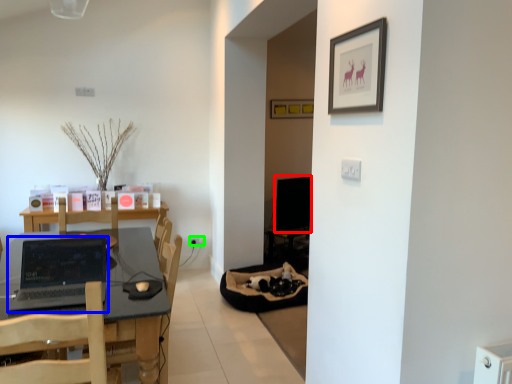
Question: Based on their relative distances, which object is nearer to computer monitor (highlighted by a red box)? Choose from laptop (highlighted by a blue box) and electric outlet (highlighted by a green box).

Choices:
 (A) laptop
 (B) electric outlet

Answer: (B)